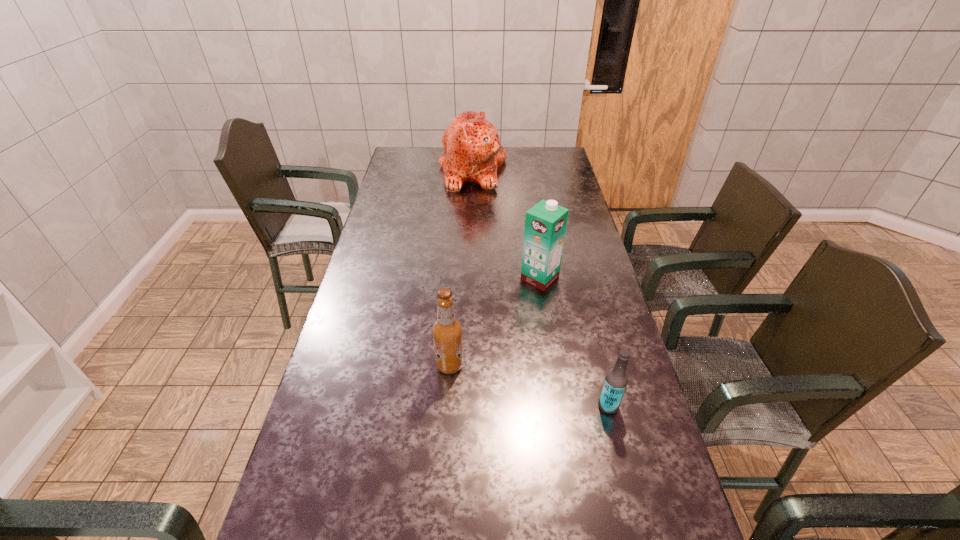
The width and height of the screenshot is (960, 540). Find the location of `free space located on the label of the rightmost object`. free space located on the label of the rightmost object is located at coordinates (528, 406).

Image resolution: width=960 pixels, height=540 pixels. In order to click on free space located on the label of the rightmost object in this screenshot , I will do `click(519, 406)`.

Identify the location of free space located 0.400m on the label of the rightmost object. (442, 406).

Where is `object positioned at the far edge`? The height and width of the screenshot is (540, 960). object positioned at the far edge is located at coordinates (472, 153).

Where is `carton positioned at the right edge`? The height and width of the screenshot is (540, 960). carton positioned at the right edge is located at coordinates (545, 223).

You are a GUI agent. You are given a task and a screenshot of the screen. Output one action in this format:
    pyautogui.click(x=<x>, y=<y>)
    Task: Click on the beer bottle located at the right edge
    Image resolution: width=960 pixels, height=540 pixels.
    Given the screenshot: What is the action you would take?
    pyautogui.click(x=616, y=379)

Find the location of a particular element. This screenshot has height=540, width=960. vacant space at the left edge is located at coordinates (371, 301).

Where is `vacant position at the right edge of the desktop`? vacant position at the right edge of the desktop is located at coordinates tap(651, 467).

This screenshot has width=960, height=540. In order to click on vacant space at the far left corner of the desktop in this screenshot , I will do `click(422, 156)`.

You are a GUI agent. You are given a task and a screenshot of the screen. Output one action in this format:
    pyautogui.click(x=<x>, y=<y>)
    Task: Click on the vacant space that is in between the second farthest object and the right beer bottle
    The height and width of the screenshot is (540, 960).
    Given the screenshot: What is the action you would take?
    pyautogui.click(x=574, y=342)